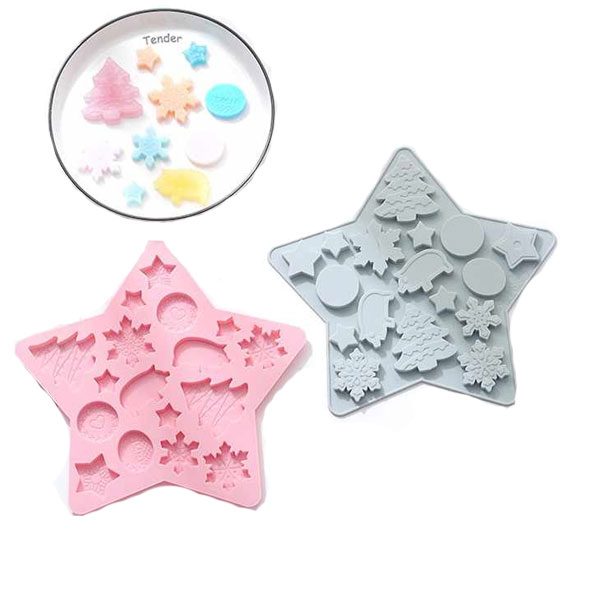
The image size is (600, 600). I want to click on plate, so click(x=235, y=61).